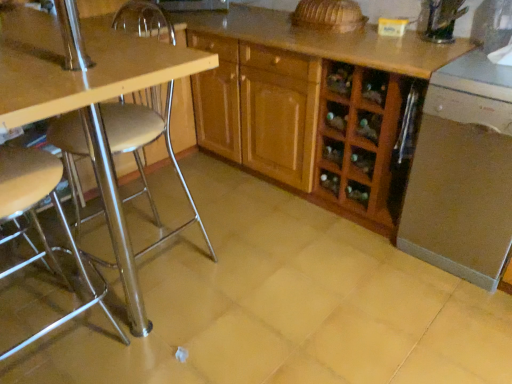
Question: From a real-world perspective, is wooden cabinet at center on wooden table at left?

Choices:
 (A) yes
 (B) no

Answer: (B)

Question: Is wooden table at left located within wooden cabinet at center?

Choices:
 (A) no
 (B) yes

Answer: (A)

Question: Considering the relative positions of wooden cabinet at center and wooden table at left in the image provided, is wooden cabinet at center to the right of wooden table at left from the viewer's perspective?

Choices:
 (A) no
 (B) yes

Answer: (B)

Question: From the image's perspective, would you say wooden cabinet at center is positioned over wooden table at left?

Choices:
 (A) yes
 (B) no

Answer: (A)

Question: From a real-world perspective, is wooden cabinet at center under wooden table at left?

Choices:
 (A) yes
 (B) no

Answer: (A)

Question: Is wooden cabinet at center facing away from wooden table at left?

Choices:
 (A) no
 (B) yes

Answer: (A)

Question: Does satin silver dishwasher at lower right lie behind metallic silver stool at left?

Choices:
 (A) yes
 (B) no

Answer: (A)

Question: Can you confirm if satin silver dishwasher at lower right is shorter than metallic silver stool at left?

Choices:
 (A) yes
 (B) no

Answer: (A)

Question: From the image's perspective, is satin silver dishwasher at lower right over metallic silver stool at left?

Choices:
 (A) no
 (B) yes

Answer: (B)

Question: Considering the relative sizes of satin silver dishwasher at lower right and metallic silver stool at left in the image provided, is satin silver dishwasher at lower right wider than metallic silver stool at left?

Choices:
 (A) no
 (B) yes

Answer: (B)

Question: Is satin silver dishwasher at lower right facing away from metallic silver stool at left?

Choices:
 (A) no
 (B) yes

Answer: (A)

Question: Is satin silver dishwasher at lower right thinner than metallic silver stool at left?

Choices:
 (A) yes
 (B) no

Answer: (B)

Question: Is there a large distance between metallic silver stool at left and satin silver dishwasher at lower right?

Choices:
 (A) no
 (B) yes

Answer: (B)